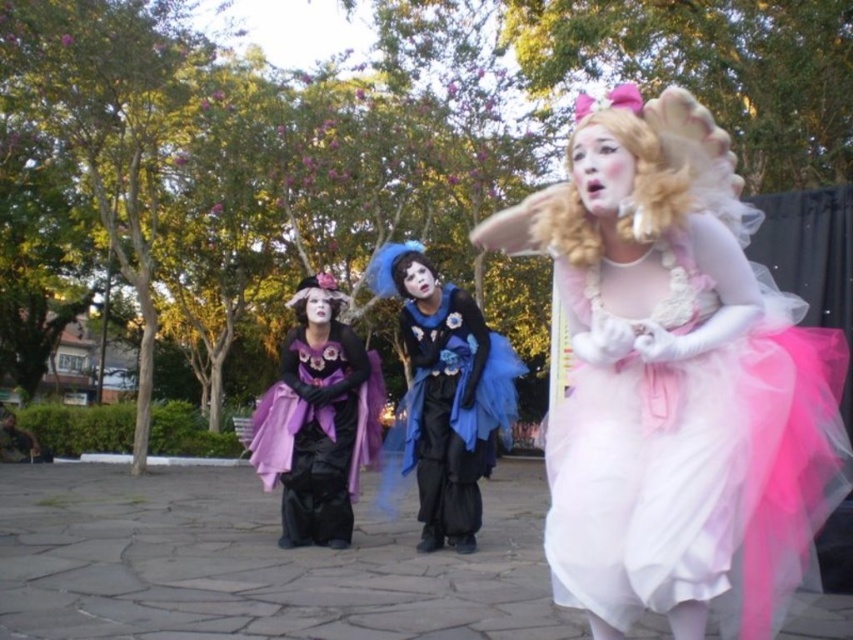
In the image, there are three costumed individuals in a park with paved stone pathways and tall leafy trees with purple flowers. You are standing at the point with coordinates point (x=453, y=410). Which object are you closest to?

The point (x=453, y=410) corresponds to the matte blue tulle dress at center, so you are closest to the matte blue tulle dress at center.

You are a photographer setting up for a group photo. You have a camera with a 12 inch depth of field. The subjects include the matte blue tulle dress at center and the blue tulle wig at center. Can both subjects be in focus simultaneously?

The matte blue tulle dress at center is 12.38 inches away from the blue tulle wig at center. Since the distance between them exceeds the camera lens depth of field of 12 inches, they cannot both be in focus at the same time.